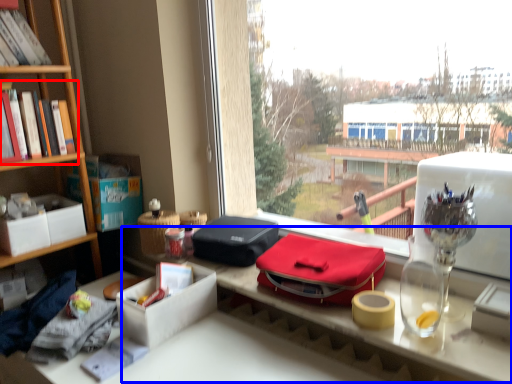
Question: Which object is closer to the camera taking this photo, book (highlighted by a red box) or table (highlighted by a blue box)?

Choices:
 (A) book
 (B) table

Answer: (B)